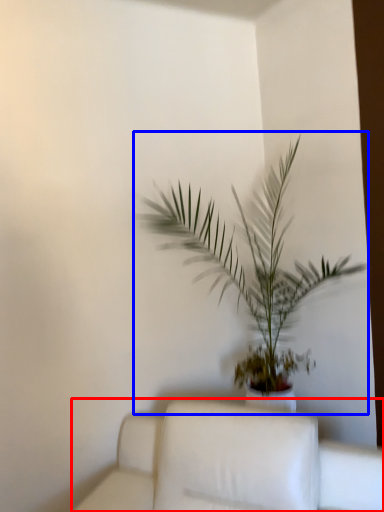
Question: Which object appears closest to the camera in this image, furniture (highlighted by a red box) or houseplant (highlighted by a blue box)?

Choices:
 (A) furniture
 (B) houseplant

Answer: (A)